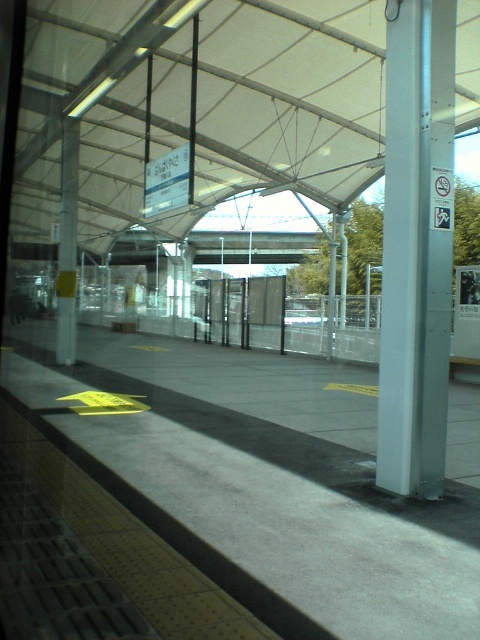
You are a maintenance worker at the bus stop who needs to inspect the white fabric canopy at upper center and the silver metallic pole at right. You have a 10 meter long ladder. Can you reach both objects with the ladder from the ground without moving it?

The distance between the white fabric canopy at upper center and the silver metallic pole at right is 11.45 meters. Since the ladder is only 10 meters long, it cannot span the entire distance between them. Therefore, you cannot reach both objects with the ladder without moving it.

You are standing at the bus stop and want to find the white fabric canopy at upper center. According to the scene description, where should you look?

The white fabric canopy at upper center is located at the 2D coordinates point (202, 102).

Consider the image. You are standing at the bus stop and want to determine the relative positions of two points marked on the platform. Which point is closer to you, the point at coordinate point at point (166, 38) or the point at point (430, 192)?

The point at point (166, 38) is closer to you because it is further to the viewer than point (430, 192).